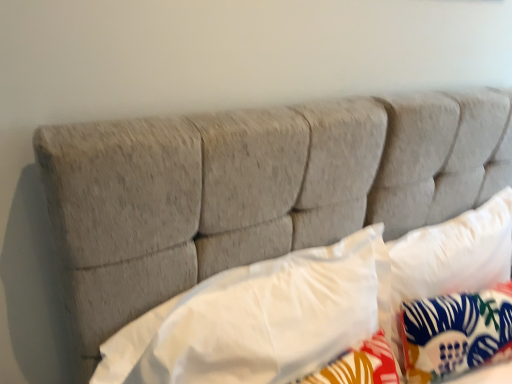
Question: Can we say blue floral fabric pillow at center, which is counted as the 1th pillow, starting from the right, lies outside white fabric pillow at center, which is the second pillow from left to right?

Choices:
 (A) no
 (B) yes

Answer: (A)

Question: Is white fabric pillow at center, which is the second pillow from left to right, completely or partially inside blue floral fabric pillow at center, which ranks as the 3th pillow in left-to-right order?

Choices:
 (A) no
 (B) yes

Answer: (A)

Question: Considering the relative positions of blue floral fabric pillow at center, which ranks as the 3th pillow in left-to-right order, and white fabric pillow at center, arranged as the second pillow when viewed from the right, in the image provided, is blue floral fabric pillow at center, which ranks as the 3th pillow in left-to-right order, to the right of white fabric pillow at center, arranged as the second pillow when viewed from the right, from the viewer's perspective?

Choices:
 (A) no
 (B) yes

Answer: (B)

Question: Is blue floral fabric pillow at center, which is counted as the 1th pillow, starting from the right, shorter than white fabric pillow at center, which is the second pillow from left to right?

Choices:
 (A) no
 (B) yes

Answer: (B)

Question: From the image's perspective, is blue floral fabric pillow at center, which is counted as the 1th pillow, starting from the right, on top of white fabric pillow at center, arranged as the second pillow when viewed from the right?

Choices:
 (A) no
 (B) yes

Answer: (A)

Question: Is white fabric pillow at center, which is the second pillow from left to right, wider or thinner than blue floral fabric pillow at center, which ranks as the 3th pillow in left-to-right order?

Choices:
 (A) thin
 (B) wide

Answer: (B)

Question: From the image's perspective, is white fabric pillow at center, which is the second pillow from left to right, above or below blue floral fabric pillow at center, which is counted as the 1th pillow, starting from the right?

Choices:
 (A) above
 (B) below

Answer: (A)

Question: Is white fabric pillow at center, arranged as the second pillow when viewed from the right, situated inside blue floral fabric pillow at center, which ranks as the 3th pillow in left-to-right order, or outside?

Choices:
 (A) outside
 (B) inside

Answer: (A)

Question: Is white fabric pillow at center, which is the second pillow from left to right, to the left or to the right of blue floral fabric pillow at center, which ranks as the 3th pillow in left-to-right order, in the image?

Choices:
 (A) right
 (B) left

Answer: (B)

Question: Is white soft pillow at center, which is counted as the 1th pillow, starting from the left, taller or shorter than blue floral fabric pillow at center, which ranks as the 3th pillow in left-to-right order?

Choices:
 (A) short
 (B) tall

Answer: (B)

Question: From the image's perspective, is white soft pillow at center, which is counted as the 1th pillow, starting from the left, located above or below blue floral fabric pillow at center, which ranks as the 3th pillow in left-to-right order?

Choices:
 (A) below
 (B) above

Answer: (B)

Question: Is white soft pillow at center, which is counted as the 1th pillow, starting from the left, situated inside blue floral fabric pillow at center, which is counted as the 1th pillow, starting from the right, or outside?

Choices:
 (A) inside
 (B) outside

Answer: (B)

Question: Considering the positions of white soft pillow at center, which is the 3th pillow in right-to-left order, and blue floral fabric pillow at center, which is counted as the 1th pillow, starting from the right, in the image, is white soft pillow at center, which is the 3th pillow in right-to-left order, bigger or smaller than blue floral fabric pillow at center, which is counted as the 1th pillow, starting from the right,?

Choices:
 (A) small
 (B) big

Answer: (B)

Question: Is blue floral fabric pillow at center, which ranks as the 3th pillow in left-to-right order, bigger or smaller than white fabric pillow at center, arranged as the second pillow when viewed from the right?

Choices:
 (A) big
 (B) small

Answer: (B)

Question: In terms of width, does blue floral fabric pillow at center, which is counted as the 1th pillow, starting from the right, look wider or thinner when compared to white fabric pillow at center, which is the second pillow from left to right?

Choices:
 (A) wide
 (B) thin

Answer: (B)